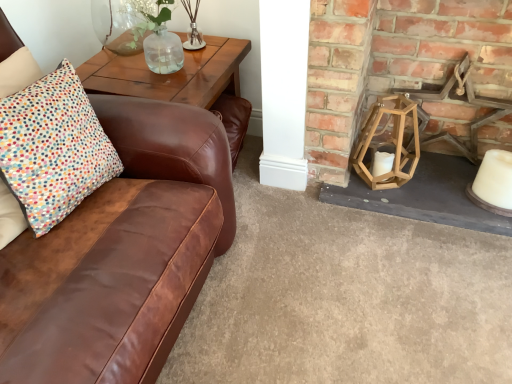
Question: In the image, is clear glass vase at upper center, marked as the 1th candle holder in a top-to-bottom arrangement, on the left side or the right side of wooden lantern at right?

Choices:
 (A) right
 (B) left

Answer: (B)

Question: Is point (181, 1) positioned closer to the camera than point (458, 134)?

Choices:
 (A) closer
 (B) farther

Answer: (A)

Question: Estimate the real-world distances between objects in this image. Which object is closer to the wooden table at upper left?

Choices:
 (A) wooden lantern at right
 (B) multicolored dotted cushion at left
 (C) white matte candle at lower right
 (D) wooden hexagonal lantern at right, which ranks as the second candle holder in top-to-bottom order
 (E) clear glass vase at upper center, acting as the 2th candle holder starting from the right

Answer: (E)

Question: Estimate the real-world distances between objects in this image. Which object is closer to the wooden hexagonal lantern at right, the first candle holder from the right?

Choices:
 (A) white matte candle at lower right
 (B) multicolored dotted cushion at left
 (C) clear glass vase at upper center, arranged as the second candle holder when ordered from the bottom
 (D) wooden table at upper left
 (E) wooden lantern at right

Answer: (E)